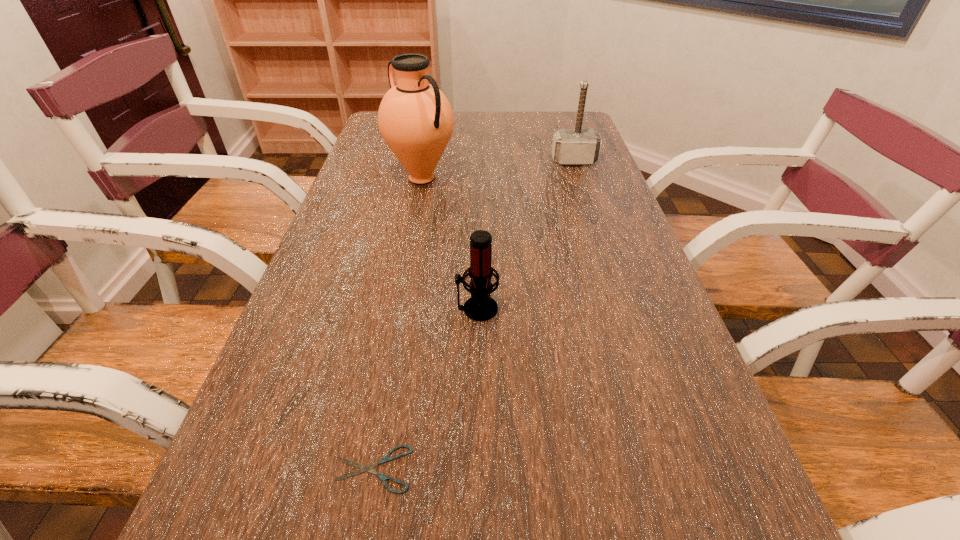
You are a GUI agent. You are given a task and a screenshot of the screen. Output one action in this format:
    pyautogui.click(x=<x>, y=<y>)
    Task: Click on the vacant space positioned on the right of the shears
    The image size is (960, 540).
    Given the screenshot: What is the action you would take?
    pyautogui.click(x=451, y=469)

The width and height of the screenshot is (960, 540). In order to click on object that is at the left edge in this screenshot , I will do `click(415, 119)`.

You are a GUI agent. You are given a task and a screenshot of the screen. Output one action in this format:
    pyautogui.click(x=<x>, y=<y>)
    Task: Click on the object situated at the right edge
    Image resolution: width=960 pixels, height=540 pixels.
    Given the screenshot: What is the action you would take?
    pyautogui.click(x=578, y=146)

This screenshot has height=540, width=960. I want to click on free spot at the far edge of the desktop, so click(x=466, y=114).

The image size is (960, 540). What are the coordinates of `vacant space at the left edge` in the screenshot? It's located at (321, 284).

This screenshot has height=540, width=960. Identify the location of vacant space at the right edge of the desktop. (689, 536).

Identify the location of free region at the far right corner. (574, 119).

At what (x,y) coordinates should I click in order to perform the action: click on vacant area that lies between the rightmost object and the microphone. Please return your answer as a coordinate pair (x, y). This screenshot has width=960, height=540. Looking at the image, I should click on (525, 235).

Identify the location of vacant point located between the third farthest object and the tallest object. (449, 244).

In order to click on vacant space that is in between the second shortest object and the tallest object in this screenshot , I will do `click(449, 244)`.